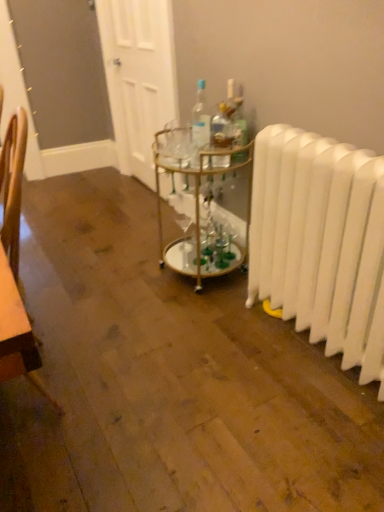
Question: From a real-world perspective, is clear glass bottle at center, which appears as the second bottle when viewed from the right, positioned above or below white plastic radiator at right?

Choices:
 (A) above
 (B) below

Answer: (A)

Question: In the image, is clear glass bottle at center, which appears as the second bottle when viewed from the right, positioned in front of or behind white plastic radiator at right?

Choices:
 (A) behind
 (B) front

Answer: (A)

Question: Which is farther from the clear glass bottle at center, which ranks as the third bottle in right-to-left order?

Choices:
 (A) white wooden door at upper center
 (B) clear glass bottle at center, which appears as the second bottle when viewed from the right
 (C) white plastic radiator at right
 (D) gold metallic bar cart at center
 (E) translucent glass bottle at center, the 3th bottle when ordered from left to right

Answer: (A)

Question: Considering the real-world distances, which object is farthest from the white plastic radiator at right?

Choices:
 (A) white wooden door at upper center
 (B) clear glass bottle at center, which is counted as the 1th bottle, starting from the left
 (C) clear glass bottle at center, acting as the 2th bottle starting from the left
 (D) translucent glass bottle at center, the 3th bottle when ordered from left to right
 (E) gold metallic bar cart at center

Answer: (A)